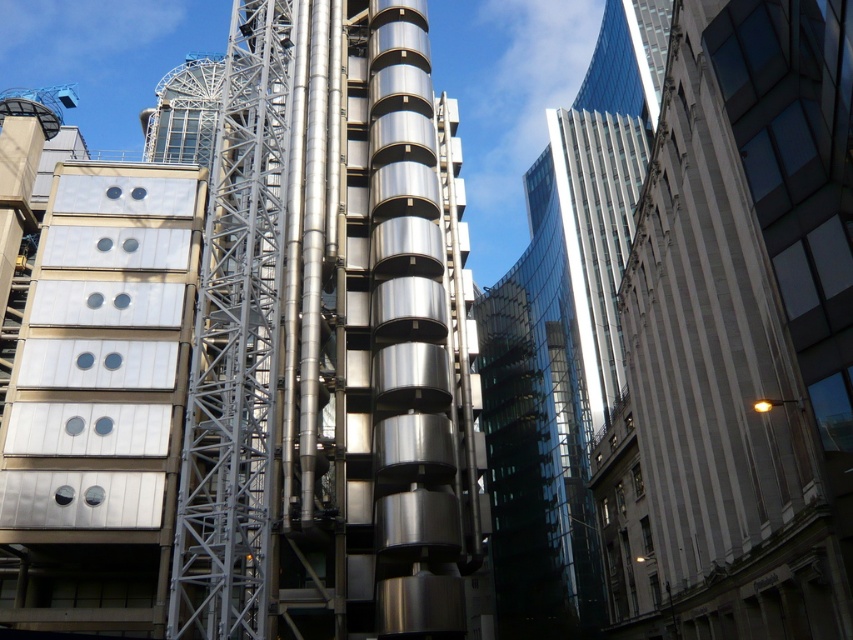
Question: Where is metallic silver tower at center located in relation to white glossy building at right in the image?

Choices:
 (A) above
 (B) below

Answer: (A)

Question: Among these points, which one is nearest to the camera?

Choices:
 (A) (451, 593)
 (B) (561, 440)
 (C) (756, 339)

Answer: (C)

Question: Which of these objects is positioned closest to the glassy reflective skyscraper at upper right?

Choices:
 (A) white glossy building at right
 (B) metallic silver tower at center

Answer: (A)

Question: Is metallic silver tower at center to the left of glassy reflective skyscraper at upper right from the viewer's perspective?

Choices:
 (A) yes
 (B) no

Answer: (A)

Question: Estimate the real-world distances between objects in this image. Which object is closer to the metallic silver tower at center?

Choices:
 (A) glassy reflective skyscraper at upper right
 (B) white glossy building at right

Answer: (B)

Question: Can you confirm if metallic silver tower at center is smaller than glassy reflective skyscraper at upper right?

Choices:
 (A) no
 (B) yes

Answer: (B)